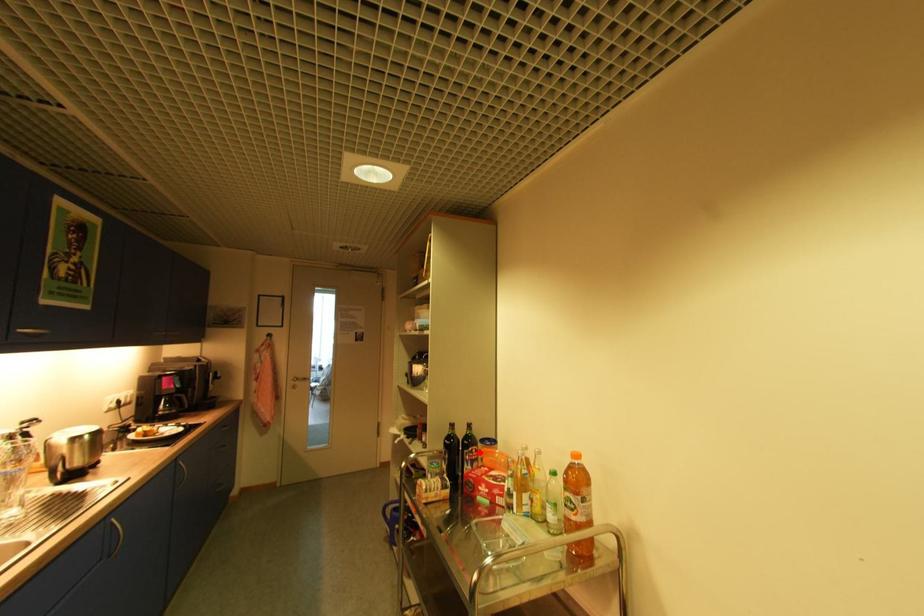
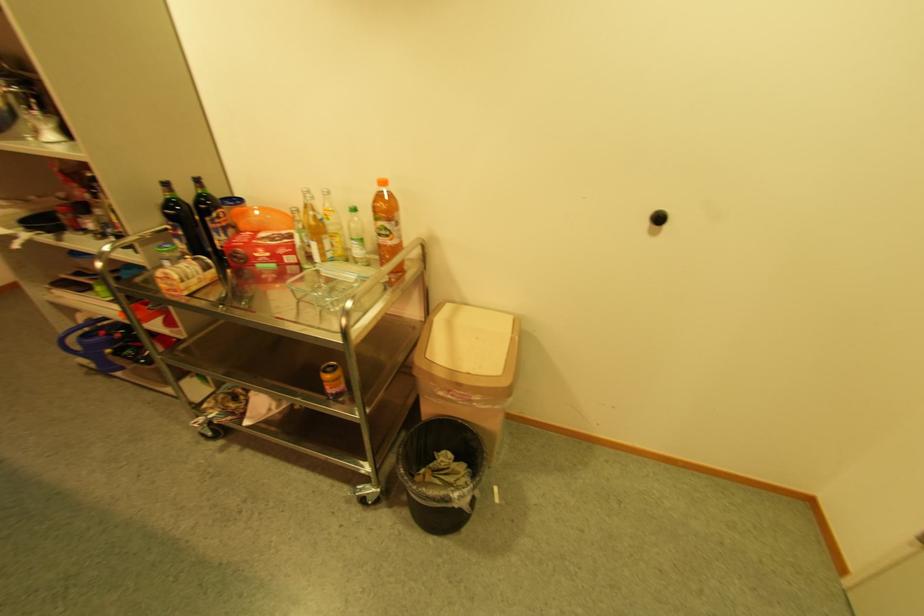
In the second image, find the point that corresponds to the highlighted location in the first image.

(227, 217)